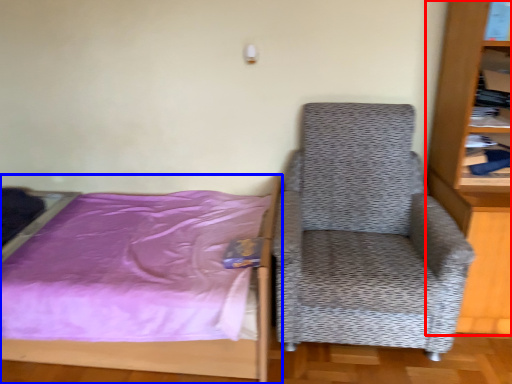
Question: Among these objects, which one is nearest to the camera, bookcase (highlighted by a red box) or bed (highlighted by a blue box)?

Choices:
 (A) bookcase
 (B) bed

Answer: (A)